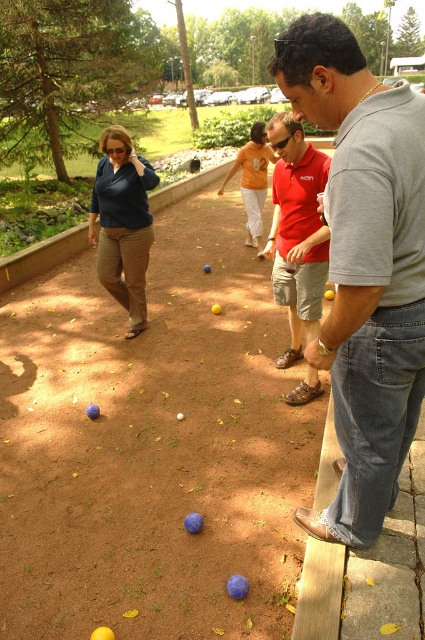
You are playing bocce ball and need to retrieve the matte red polo shirt at center. From your current position on the raised wooden platform, which direction should you move to reach it?

The matte red polo shirt at center is located at point coordinates, so you should move towards the center of the dirt area from the raised wooden platform to retrieve it.

You are a photographer trying to capture a photo of the gray cotton shirt at center and the matte red polo shirt at center. From your current position, which one is lower in the frame?

The gray cotton shirt at center is located below the matte red polo shirt at center, so the gray cotton shirt at center is lower in the frame.

You are a photographer trying to capture a photo of both the gray cotton shirt at center and the matte red polo shirt at center from a lower viewpoint. Which shirt will appear larger in the photo?

The gray cotton shirt at center is taller than the matte red polo shirt at center, so it will appear larger in the photo.